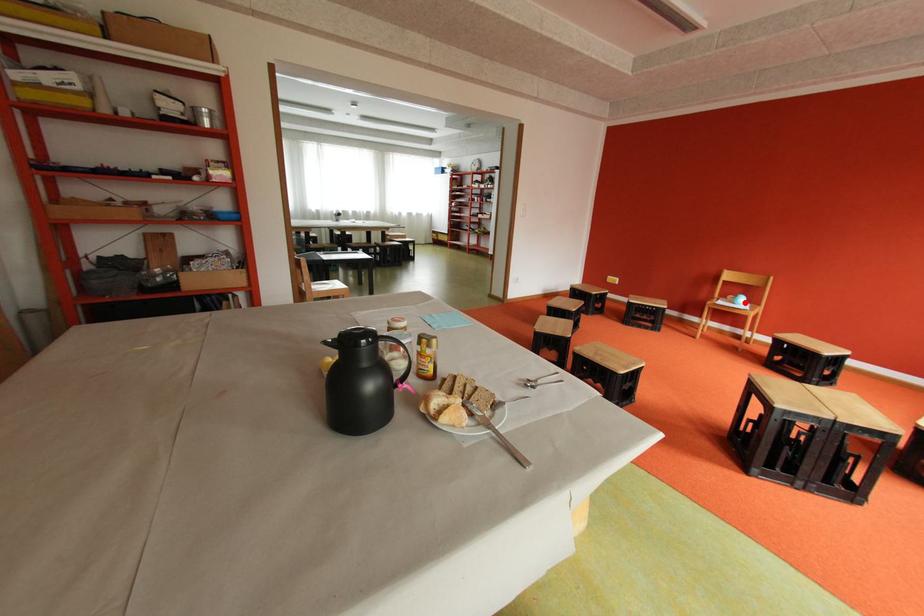
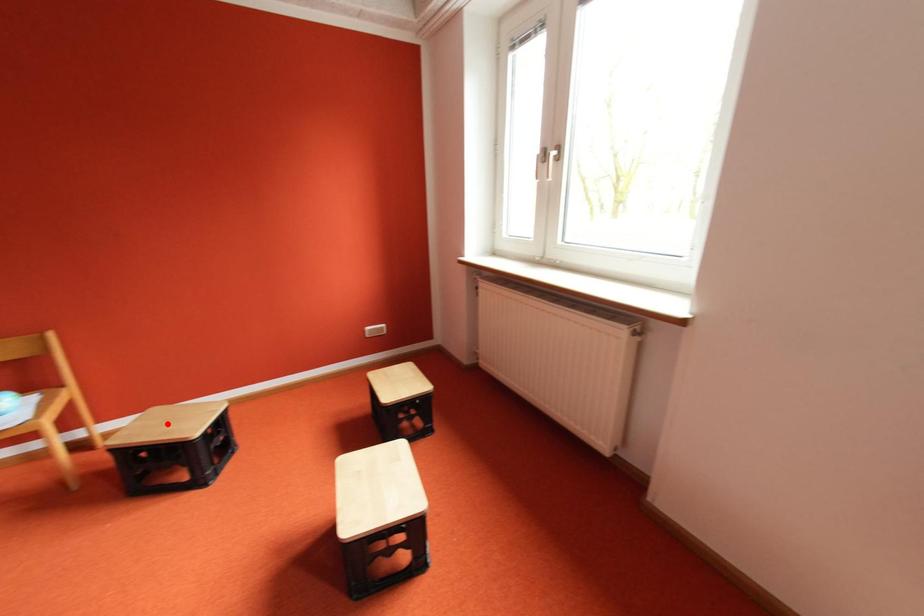
I am providing you with two images of the same scene from different viewpoints. A red point is marked on the first image and another point is marked on the second image. Does the point marked in image1 correspond to the same location as the one in image2?

No